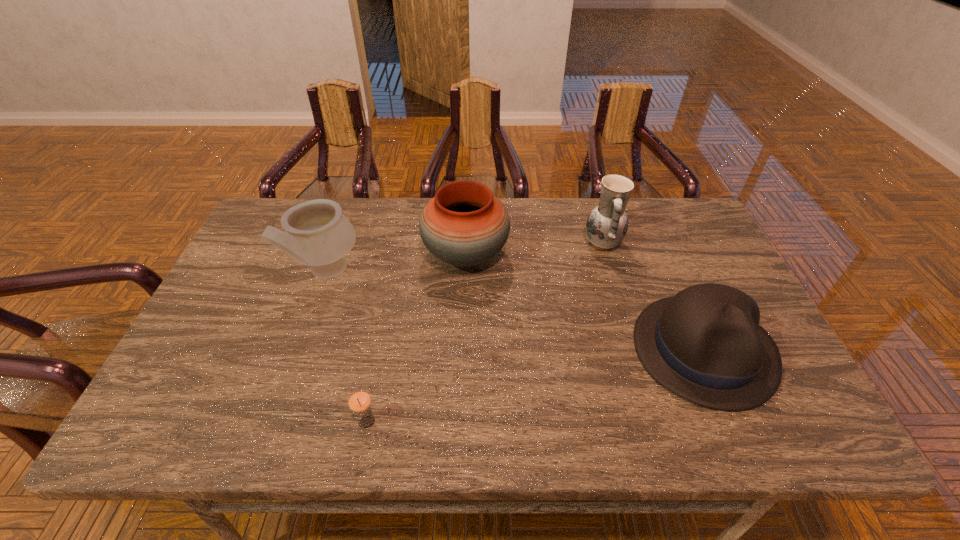
I want to click on free spot located on the right of the third object from left to right, so click(535, 255).

Locate an element on the screen. The height and width of the screenshot is (540, 960). vacant space located 0.050m on the front-facing side of the bowler hat is located at coordinates (740, 435).

The image size is (960, 540). Find the location of `free location located on the right of the shortest object`. free location located on the right of the shortest object is located at coordinates (503, 422).

Identify the location of bowler hat located at the near edge. (705, 344).

The image size is (960, 540). Find the location of `straw positioned at the near edge`. straw positioned at the near edge is located at coordinates (359, 401).

You are a GUI agent. You are given a task and a screenshot of the screen. Output one action in this format:
    pyautogui.click(x=<x>, y=<y>)
    Task: Click on the object positioned at the right edge
    This screenshot has height=540, width=960.
    Given the screenshot: What is the action you would take?
    [705, 344]

The height and width of the screenshot is (540, 960). Find the location of `object at the near right corner`. object at the near right corner is located at coordinates (705, 344).

Locate an element on the screen. The width and height of the screenshot is (960, 540). free space at the far edge of the desktop is located at coordinates (530, 221).

The image size is (960, 540). In order to click on vacant space at the near edge in this screenshot , I will do `click(227, 440)`.

Image resolution: width=960 pixels, height=540 pixels. What are the coordinates of `vacant area at the left edge` in the screenshot? It's located at (230, 288).